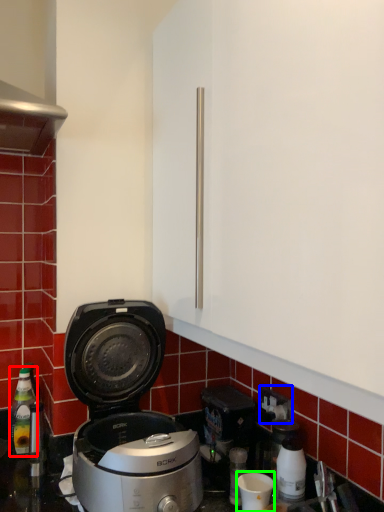
Question: Which object is positioned closest to bottle (highlighted by a red box)? Select from electric outlet (highlighted by a blue box) and appliance (highlighted by a green box).

Choices:
 (A) electric outlet
 (B) appliance

Answer: (B)